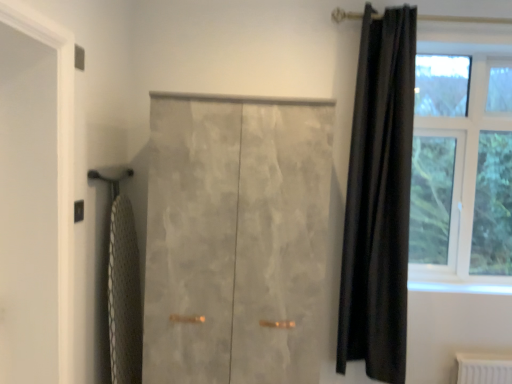
Question: Based on their sizes in the image, would you say clear glass window at upper right is bigger or smaller than black velvet curtain at right?

Choices:
 (A) big
 (B) small

Answer: (A)

Question: From the image's perspective, is clear glass window at upper right above or below black velvet curtain at right?

Choices:
 (A) below
 (B) above

Answer: (B)

Question: Which object is the closest to the white mesh bath towel at left?

Choices:
 (A) satin gray wardrobe at center
 (B) black velvet curtain at right
 (C) white matte screen door at left
 (D) clear glass window at upper right

Answer: (C)

Question: Estimate the real-world distances between objects in this image. Which object is farther from the satin gray wardrobe at center?

Choices:
 (A) white matte screen door at left
 (B) white mesh bath towel at left
 (C) clear glass window at upper right
 (D) black velvet curtain at right

Answer: (C)